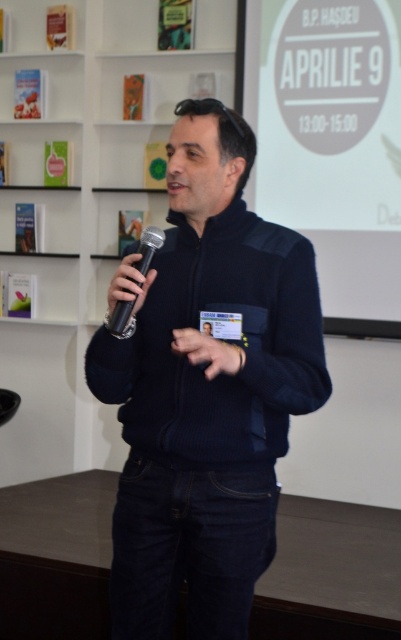
Question: Which of the following is the farthest from the observer?

Choices:
 (A) white matte bookshelf at upper left
 (B) dark blue sweater at center

Answer: (A)

Question: Does white matte bookshelf at upper left appear on the left side of white matte projection screen at upper center?

Choices:
 (A) yes
 (B) no

Answer: (A)

Question: Is dark blue sweater at center positioned in front of black matte microphone at left?

Choices:
 (A) no
 (B) yes

Answer: (B)

Question: Is dark blue sweater at center smaller than black matte microphone at left?

Choices:
 (A) no
 (B) yes

Answer: (A)

Question: Which point is farther to the camera?

Choices:
 (A) white matte projection screen at upper center
 (B) black matte microphone at left
 (C) dark blue sweater at center

Answer: (A)

Question: Based on their relative distances, which object is farther from the black matte microphone at left?

Choices:
 (A) dark blue sweater at center
 (B) white matte projection screen at upper center
 (C) white matte bookshelf at upper left

Answer: (C)